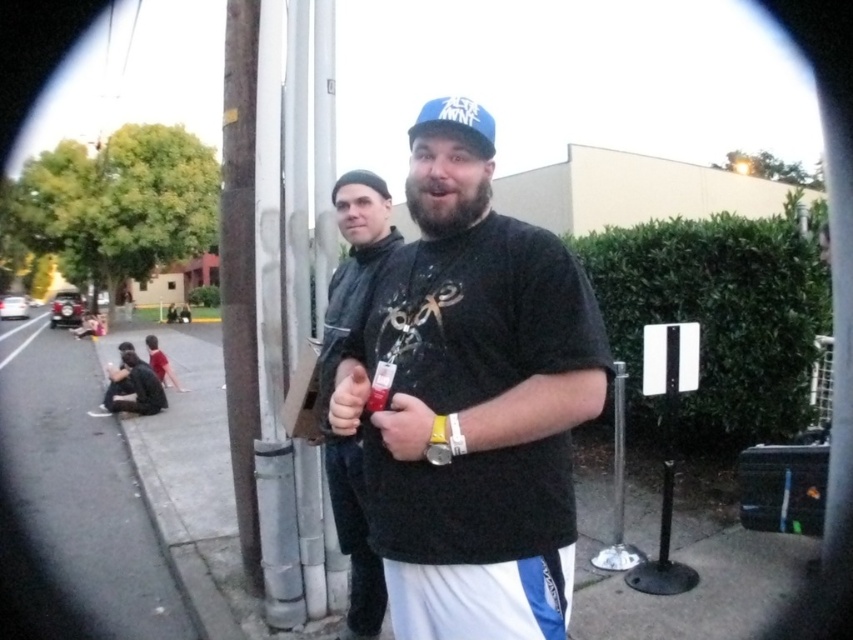
Question: Does black matte t-shirt at center have a smaller size compared to gray asphalt pavement at lower left?

Choices:
 (A) no
 (B) yes

Answer: (B)

Question: Which object appears closest to the camera in this image?

Choices:
 (A) gray asphalt pavement at lower left
 (B) matte black jacket at center
 (C) dark gray hoodie at lower left
 (D) black matte t-shirt at center

Answer: (D)

Question: Which object is farther from the camera taking this photo?

Choices:
 (A) matte black jacket at center
 (B) dark gray hoodie at lower left

Answer: (B)

Question: In this image, where is gray asphalt pavement at lower left located relative to matte black jacket at center?

Choices:
 (A) below
 (B) above

Answer: (A)

Question: From the image, what is the correct spatial relationship of black matte t-shirt at center in relation to gray asphalt pavement at lower left?

Choices:
 (A) left
 (B) right

Answer: (B)

Question: Considering the real-world distances, which object is closest to the dark gray hoodie at lower left?

Choices:
 (A) black matte t-shirt at center
 (B) gray asphalt pavement at lower left

Answer: (B)